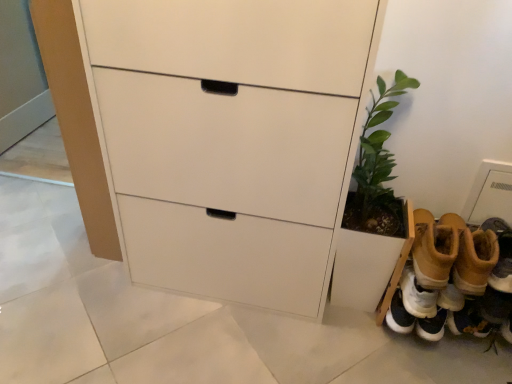
Question: Considering the relative sizes of white matte chest of drawers at center and tan suede boots at lower right, placed as the second footwear when sorted from left to right, in the image provided, is white matte chest of drawers at center bigger than tan suede boots at lower right, placed as the second footwear when sorted from left to right,?

Choices:
 (A) yes
 (B) no

Answer: (A)

Question: From a real-world perspective, is white matte chest of drawers at center physically above tan suede boots at lower right, placed as the second footwear when sorted from left to right?

Choices:
 (A) no
 (B) yes

Answer: (B)

Question: Is white matte chest of drawers at center oriented towards tan suede boots at lower right, placed as the second footwear when sorted from left to right?

Choices:
 (A) yes
 (B) no

Answer: (B)

Question: Would you say white matte chest of drawers at center is outside tan suede boots at lower right, placed as the second footwear when sorted from left to right?

Choices:
 (A) yes
 (B) no

Answer: (A)

Question: Is tan suede boots at lower right, placed as the second footwear when sorted from left to right, surrounded by white matte chest of drawers at center?

Choices:
 (A) yes
 (B) no

Answer: (B)

Question: Is white matte chest of drawers at center looking in the opposite direction of tan suede boots at lower right, positioned as the first footwear in right-to-left order?

Choices:
 (A) yes
 (B) no

Answer: (B)

Question: Is green leafy plant at lower right touching white matte chest of drawers at center?

Choices:
 (A) yes
 (B) no

Answer: (B)

Question: Does green leafy plant at lower right appear on the left side of white matte chest of drawers at center?

Choices:
 (A) yes
 (B) no

Answer: (B)

Question: Does green leafy plant at lower right turn towards white matte chest of drawers at center?

Choices:
 (A) yes
 (B) no

Answer: (B)

Question: Can you confirm if green leafy plant at lower right is taller than white matte chest of drawers at center?

Choices:
 (A) yes
 (B) no

Answer: (B)

Question: From a real-world perspective, does green leafy plant at lower right stand above white matte chest of drawers at center?

Choices:
 (A) no
 (B) yes

Answer: (A)

Question: Are green leafy plant at lower right and white matte chest of drawers at center far apart?

Choices:
 (A) yes
 (B) no

Answer: (B)

Question: Is tan suede boots at lower right, which appears as the 2th footwear when viewed from the right, with white matte chest of drawers at center?

Choices:
 (A) no
 (B) yes

Answer: (A)